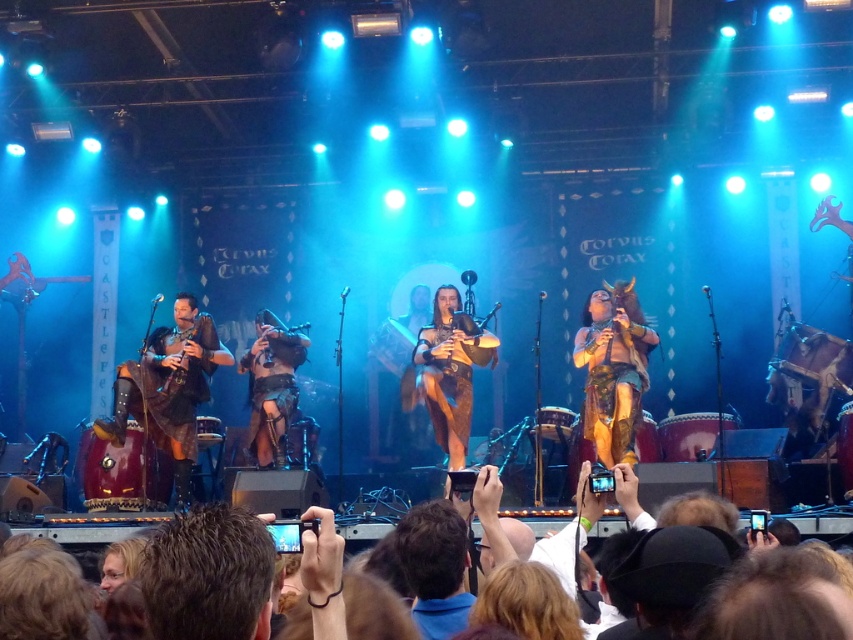
Question: Among these objects, which one is nearest to the camera?

Choices:
 (A) leather-like brown vest at right
 (B) leather bagpipes at left

Answer: (A)

Question: Which point appears closest to the camera in this image?

Choices:
 (A) (183, 444)
 (B) (451, 312)

Answer: (A)

Question: Among these points, which one is nearest to the camera?

Choices:
 (A) (184, 332)
 (B) (616, 317)

Answer: (B)

Question: Can you confirm if brown leather bagpipes at center is positioned to the right of leather/rough bagpipes at center?

Choices:
 (A) yes
 (B) no

Answer: (A)

Question: Is leather-like brown vest at right bigger than leather/rough bagpipes at center?

Choices:
 (A) no
 (B) yes

Answer: (B)

Question: Can you confirm if leather bagpipes at left is thinner than leather-like brown vest at right?

Choices:
 (A) yes
 (B) no

Answer: (B)